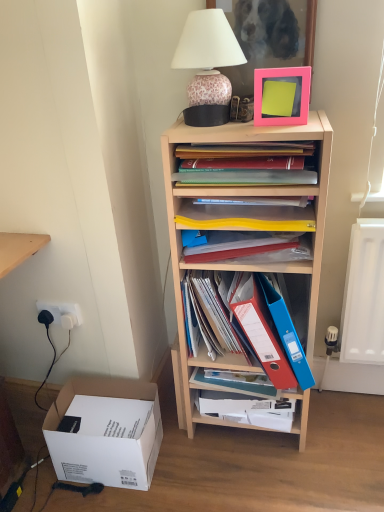
Question: Is matte blue folder at center, marked as the 1th book in a bottom-to-top arrangement, facing towards leopard print ceramic lamp at upper center?

Choices:
 (A) no
 (B) yes

Answer: (A)

Question: Is matte blue folder at center, marked as the 1th book in a bottom-to-top arrangement, further to camera compared to leopard print ceramic lamp at upper center?

Choices:
 (A) yes
 (B) no

Answer: (A)

Question: Can you confirm if matte blue folder at center, which is the third book from top to bottom, is shorter than leopard print ceramic lamp at upper center?

Choices:
 (A) no
 (B) yes

Answer: (B)

Question: From a real-world perspective, is matte blue folder at center, which is the third book from top to bottom, on leopard print ceramic lamp at upper center?

Choices:
 (A) no
 (B) yes

Answer: (A)

Question: Considering the relative sizes of matte blue folder at center, marked as the 1th book in a bottom-to-top arrangement, and leopard print ceramic lamp at upper center in the image provided, is matte blue folder at center, marked as the 1th book in a bottom-to-top arrangement, thinner than leopard print ceramic lamp at upper center?

Choices:
 (A) yes
 (B) no

Answer: (A)

Question: Which is correct: matte blue folder at center, marked as the 1th book in a bottom-to-top arrangement, is inside blue plastic folder at center right, the first paperback book in the right-to-left sequence, or outside of it?

Choices:
 (A) inside
 (B) outside

Answer: (B)

Question: Is matte blue folder at center, marked as the 1th book in a bottom-to-top arrangement, wider or thinner than blue plastic folder at center right, the first paperback book in the right-to-left sequence?

Choices:
 (A) thin
 (B) wide

Answer: (A)

Question: Based on their sizes in the image, would you say matte blue folder at center, marked as the 1th book in a bottom-to-top arrangement, is bigger or smaller than blue plastic folder at center right, positioned as the second paperback book in left-to-right order?

Choices:
 (A) small
 (B) big

Answer: (A)

Question: From the image's perspective, relative to blue plastic folder at center right, positioned as the second paperback book in left-to-right order, is matte blue folder at center, marked as the 1th book in a bottom-to-top arrangement, above or below?

Choices:
 (A) below
 (B) above

Answer: (A)

Question: Considering the positions of point (220, 88) and point (198, 398), is point (220, 88) closer or farther from the camera than point (198, 398)?

Choices:
 (A) closer
 (B) farther

Answer: (A)

Question: Choose the correct answer: Is leopard print ceramic lamp at upper center inside matte blue folder at center, which is the third book from top to bottom, or outside it?

Choices:
 (A) inside
 (B) outside

Answer: (B)

Question: Looking at the image, does leopard print ceramic lamp at upper center seem bigger or smaller compared to matte blue folder at center, marked as the 1th book in a bottom-to-top arrangement?

Choices:
 (A) small
 (B) big

Answer: (B)

Question: From the image's perspective, is leopard print ceramic lamp at upper center above or below matte blue folder at center, marked as the 1th book in a bottom-to-top arrangement?

Choices:
 (A) above
 (B) below

Answer: (A)

Question: Does point (291, 403) appear closer or farther from the camera than point (312, 224)?

Choices:
 (A) farther
 (B) closer

Answer: (A)

Question: Considering the positions of matte blue folder at center, which is the third book from top to bottom, and wooden shelf at center in the image, is matte blue folder at center, which is the third book from top to bottom, wider or thinner than wooden shelf at center?

Choices:
 (A) wide
 (B) thin

Answer: (B)